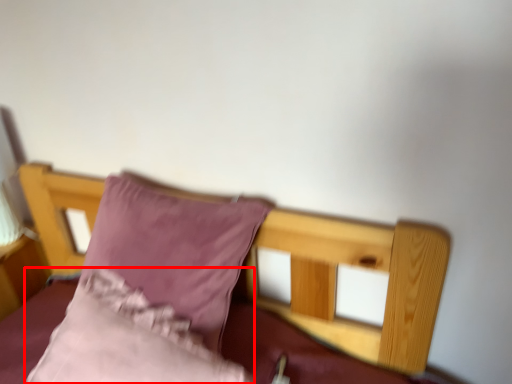
Question: From the image's perspective, where is pillow (annotated by the red box) located relative to pillow?

Choices:
 (A) above
 (B) below

Answer: (B)